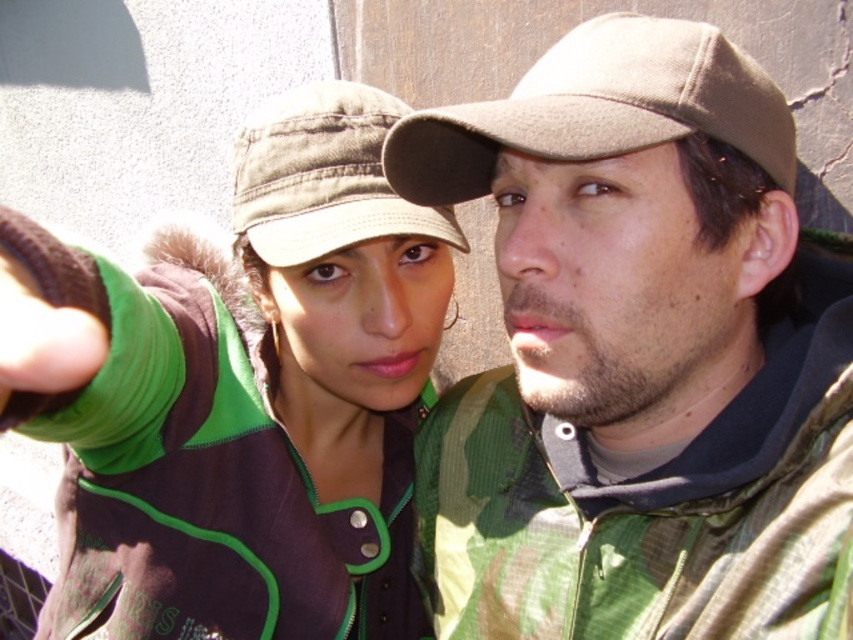
Question: Is green corduroy jacket at center thinner than beige woolen cap at upper right?

Choices:
 (A) yes
 (B) no

Answer: (B)

Question: Can you confirm if green corduroy jacket at center is wider than green fabric cap at center?

Choices:
 (A) no
 (B) yes

Answer: (B)

Question: Which object appears closest to the camera in this image?

Choices:
 (A) green corduroy jacket at center
 (B) green fabric cap at center
 (C) beige woolen cap at upper right

Answer: (A)

Question: Which object is positioned farthest from the beige woolen cap at upper right?

Choices:
 (A) green corduroy jacket at center
 (B) camouflage fabric jacket at center

Answer: (A)

Question: Which of the following is the farthest from the observer?

Choices:
 (A) camouflage fabric jacket at center
 (B) beige woolen cap at upper right
 (C) green fabric cap at center

Answer: (C)

Question: Where is beige woolen cap at upper right located in relation to green fabric cap at center in the image?

Choices:
 (A) below
 (B) above

Answer: (B)